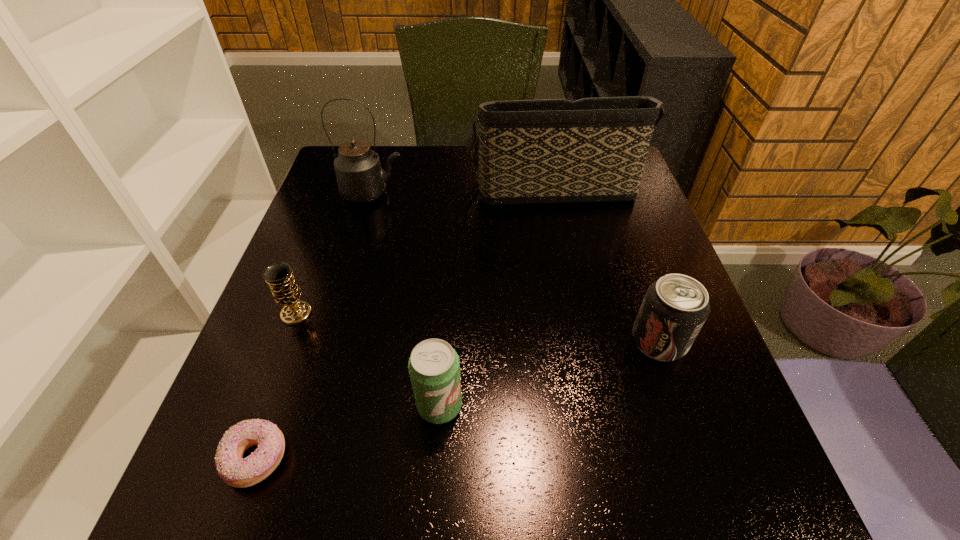
You are a GUI agent. You are given a task and a screenshot of the screen. Output one action in this format:
    pyautogui.click(x=<x>, y=<y>)
    Task: Click on the object at the far left corner
    This screenshot has width=960, height=540.
    Given the screenshot: What is the action you would take?
    pyautogui.click(x=360, y=178)

Locate an element on the screen. Image resolution: width=960 pixels, height=540 pixels. object at the near left corner is located at coordinates (236, 471).

This screenshot has width=960, height=540. What are the coordinates of `object present at the far right corner` in the screenshot? It's located at (547, 151).

At what (x,y) coordinates should I click in order to perform the action: click on free space at the far edge of the desktop. Please return your answer as a coordinate pair (x, y). This screenshot has height=540, width=960. Looking at the image, I should click on (395, 183).

You are a GUI agent. You are given a task and a screenshot of the screen. Output one action in this format:
    pyautogui.click(x=<x>, y=<y>)
    Task: Click on the free space at the near edge of the desktop
    
    Given the screenshot: What is the action you would take?
    pyautogui.click(x=540, y=498)

In the image, there is a desktop. Find the location of `blank space at the left edge`. blank space at the left edge is located at coordinates (305, 224).

You are a GUI agent. You are given a task and a screenshot of the screen. Output one action in this format:
    pyautogui.click(x=<x>, y=<y>)
    Task: Click on the free space at the right edge of the desktop
    
    Given the screenshot: What is the action you would take?
    click(x=693, y=458)

This screenshot has width=960, height=540. In the image, there is a desktop. What are the coordinates of `blank space at the near left corner` in the screenshot? It's located at (194, 510).

In the image, there is a desktop. What are the coordinates of `vacant space at the near right corner` in the screenshot? It's located at (733, 506).

This screenshot has width=960, height=540. What are the coordinates of `free space that is in between the farther soda can and the handbag` in the screenshot? It's located at tap(605, 264).